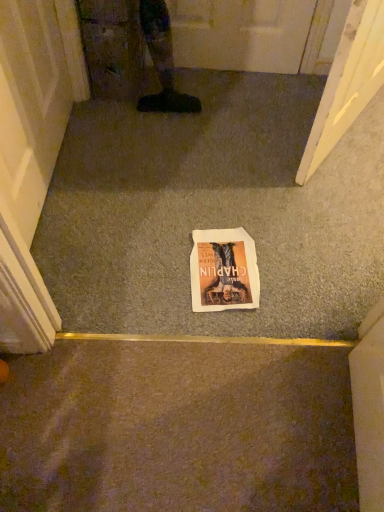
Describe the element at coordinates (214, 211) in the screenshot. I see `white paper at center` at that location.

At what (x,y) coordinates should I click in order to perform the action: click on white paper at center. Please return your answer as a coordinate pair (x, y). Image resolution: width=384 pixels, height=512 pixels. Looking at the image, I should click on (214, 211).

Measure the distance between point (199, 232) and camera.

Point (199, 232) and camera are 1.34 meters apart.

At what (x,y) coordinates should I click in order to perform the action: click on white paper comic book at center. Please return your answer as a coordinate pair (x, y). This screenshot has width=384, height=512. Looking at the image, I should click on coord(223,270).

What do you see at coordinates (223, 270) in the screenshot? This screenshot has height=512, width=384. I see `white paper comic book at center` at bounding box center [223, 270].

The image size is (384, 512). I want to click on white paper at center, so click(x=214, y=211).

Can you confirm if white paper at center is positioned to the right of white paper comic book at center?

Yes.

Consider the image. Does white paper at center lie in front of white paper comic book at center?

Yes, white paper at center is in front of white paper comic book at center.

Considering the points (208, 134) and (230, 275), which point is behind, point (208, 134) or point (230, 275)?

The point (208, 134) is more distant.

From the image's perspective, is white paper at center above white paper comic book at center?

Indeed, from the image's perspective, white paper at center is shown above white paper comic book at center.

From a real-world perspective, is white paper at center over white paper comic book at center?

No, from a real-world perspective, white paper at center is not on top of white paper comic book at center.

Considering the sizes of white paper at center and white paper comic book at center in the image, is white paper at center wider or thinner than white paper comic book at center?

white paper at center is wider than white paper comic book at center.

Is white paper at center taller than white paper comic book at center?

Yes.

Does white paper at center have a smaller size compared to white paper comic book at center?

No.

Is white paper at center surrounding white paper comic book at center?

Indeed, white paper comic book at center is located within white paper at center.

Is white paper at center not near white paper comic book at center?

They are positioned close to each other.

Is white paper at center facing towards white paper comic book at center?

Yes, white paper at center is aimed at white paper comic book at center.

Can you tell me how much white paper at center and white paper comic book at center differ in facing direction?

3.95 degrees separate the facing orientations of white paper at center and white paper comic book at center.

The height and width of the screenshot is (512, 384). Identify the location of comic book that appears on the left of white paper at center. (223, 270).

Is white paper comic book at center at the right side of white paper at center?

No, white paper comic book at center is not to the right of white paper at center.

Between white paper comic book at center and white paper at center, which one is positioned in front?

white paper at center is in front.

Is point (244, 292) more distant than point (103, 295)?

Yes, it is behind point (103, 295).

From the image's perspective, who appears lower, white paper comic book at center or white paper at center?

white paper comic book at center.

From a real-world perspective, is white paper comic book at center located higher than white paper at center?

Indeed, from a real-world perspective, white paper comic book at center stands above white paper at center.

Is white paper comic book at center wider or thinner than white paper at center?

white paper comic book at center is thinner than white paper at center.

Considering the relative sizes of white paper comic book at center and white paper at center in the image provided, is white paper comic book at center taller than white paper at center?

No.

Does white paper comic book at center have a smaller size compared to white paper at center?

Indeed, white paper comic book at center has a smaller size compared to white paper at center.

Is white paper comic book at center outside of white paper at center?

No, white paper comic book at center is inside white paper at center's boundary.

Are white paper comic book at center and white paper at center beside each other?

Result: No, white paper comic book at center is not beside white paper at center.

Is white paper at center at the back of white paper comic book at center?

Yes, white paper comic book at center is positioned with its back facing white paper at center.

Can you tell me how much white paper comic book at center and white paper at center differ in facing direction?

3.95 degrees separate the facing orientations of white paper comic book at center and white paper at center.

How far apart are white paper comic book at center and white paper at center?

white paper comic book at center and white paper at center are 9.90 inches apart from each other.

At what (x,y) coordinates should I click in order to perform the action: click on concrete below the white paper comic book at center (from a real-world perspective). Please return your answer as a coordinate pair (x, y). The height and width of the screenshot is (512, 384). Looking at the image, I should click on (214, 211).

Where is `concrete that is in front of the white paper comic book at center`? concrete that is in front of the white paper comic book at center is located at coordinates (214, 211).

I want to click on comic book that appears above the white paper at center (from a real-world perspective), so click(223, 270).